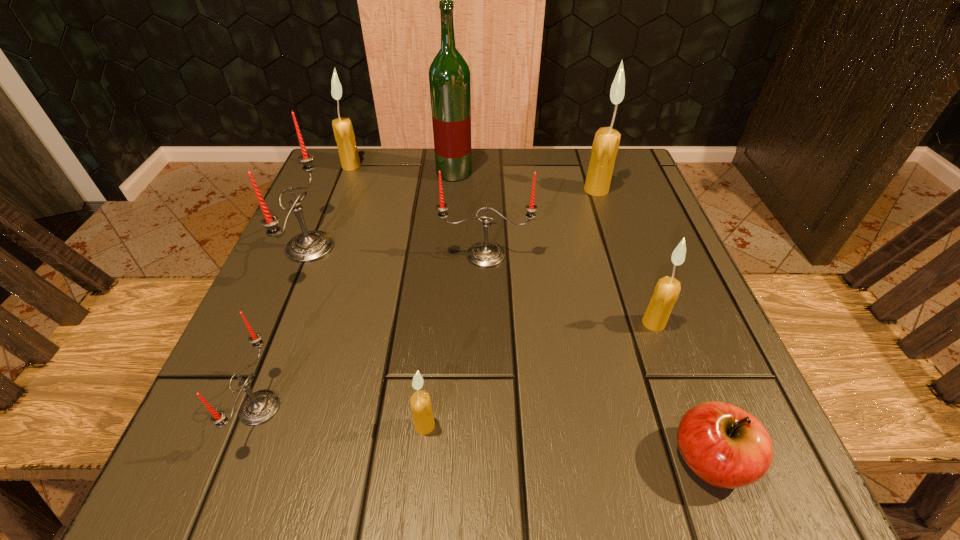
Identify the location of liquor. The width and height of the screenshot is (960, 540). (449, 76).

Image resolution: width=960 pixels, height=540 pixels. I want to click on green liquor, so click(x=449, y=76).

At what (x,y) coordinates should I click in order to perform the action: click on the sixth nearest candle. Please return your answer as a coordinate pair (x, y). The width and height of the screenshot is (960, 540). Looking at the image, I should click on (605, 146).

I want to click on the second farthest cream candle, so click(x=605, y=146).

Find the location of a particular element. the second biggest cream candle is located at coordinates (344, 135).

At what (x,y) coordinates should I click in order to perform the action: click on the farthest cream candle. Please return your answer as a coordinate pair (x, y). Looking at the image, I should click on (344, 135).

The image size is (960, 540). Identify the location of the biggest red candle. (309, 246).

Identify the location of the second smallest red candle. (485, 254).

Locate an element on the screen. The width and height of the screenshot is (960, 540). the third farthest cream candle is located at coordinates (666, 292).

The image size is (960, 540). I want to click on the sixth farthest object, so click(666, 292).